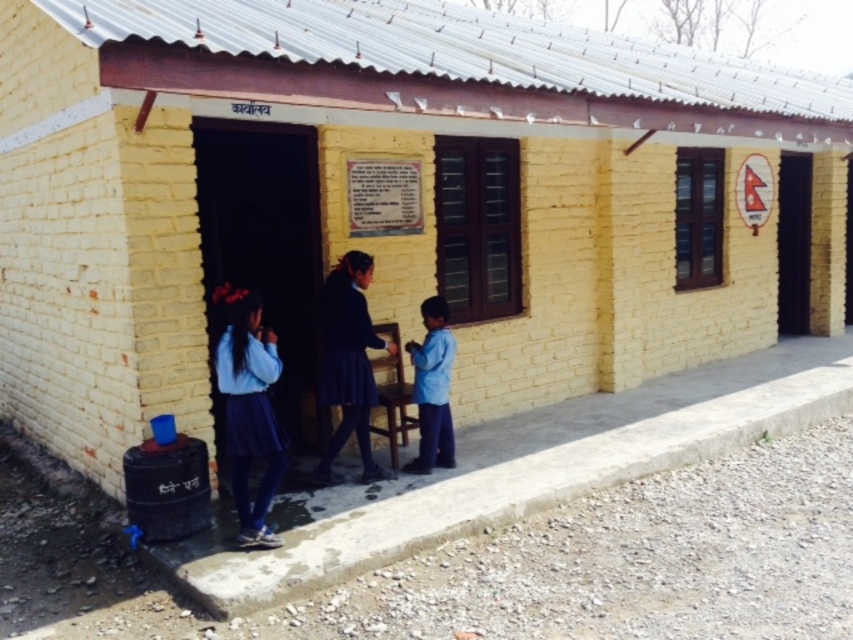
You are a tailor who needs to determine which clothing item requires more fabric. You see the dark blue skirt at center and the blue cotton shirt at lower center in the image. Based on their sizes, which one would need more fabric?

The dark blue skirt at center is larger in size than the blue cotton shirt at lower center, so it would require more fabric.

You are a fashion designer observing the scene and notice the matte blue skirt at lower left and the blue cotton shirt at lower center. Which clothing item is located to the left of the other?

The matte blue skirt at lower left is positioned on the left side of blue cotton shirt at lower center.

You are a photographer trying to capture the woman standing near the entrance of the building. You notice the dark blue skirt at center and the blue cotton shirt at lower center. Which clothing item is closer to the camera?

The dark blue skirt at center is closer to the camera because it is in front of the blue cotton shirt at lower center.